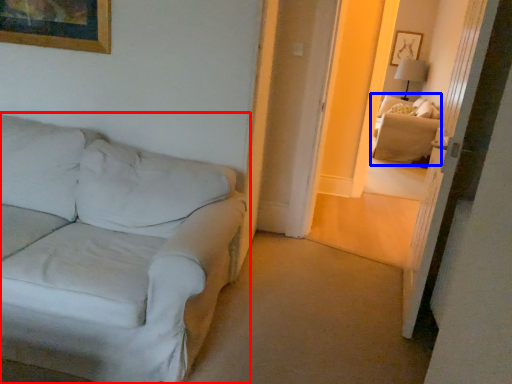
Question: Which object appears closest to the camera in this image, studio couch (highlighted by a red box) or couch (highlighted by a blue box)?

Choices:
 (A) studio couch
 (B) couch

Answer: (A)